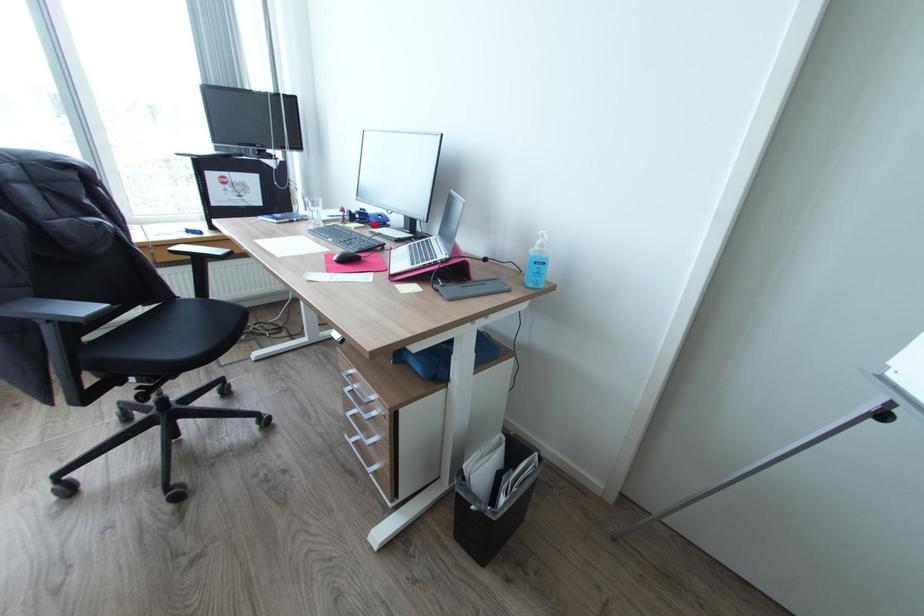
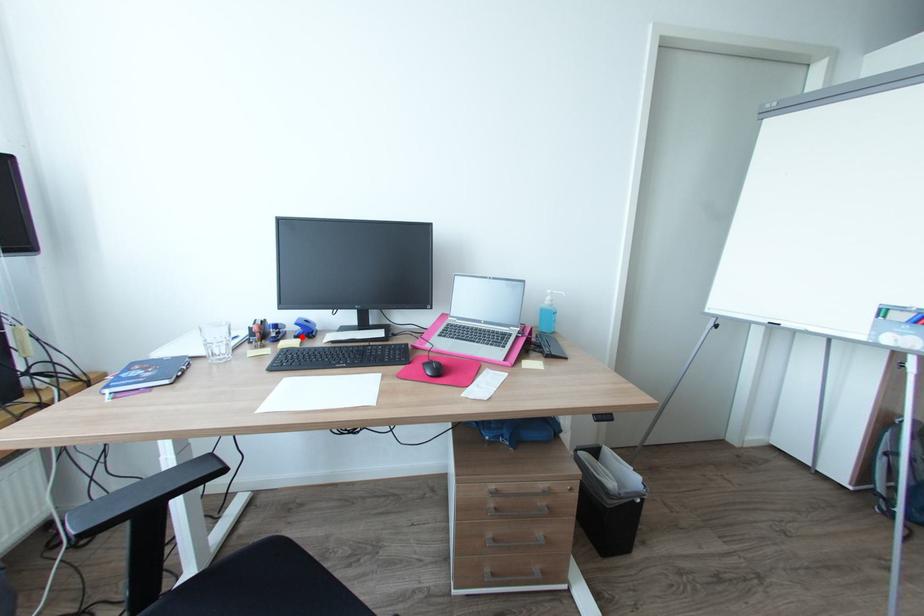
I am providing you with two images of the same scene from different viewpoints. A red point is marked on the first image and another point is marked on the second image. Do the highlighted points in image1 and image2 indicate the same real-world spot?

Yes